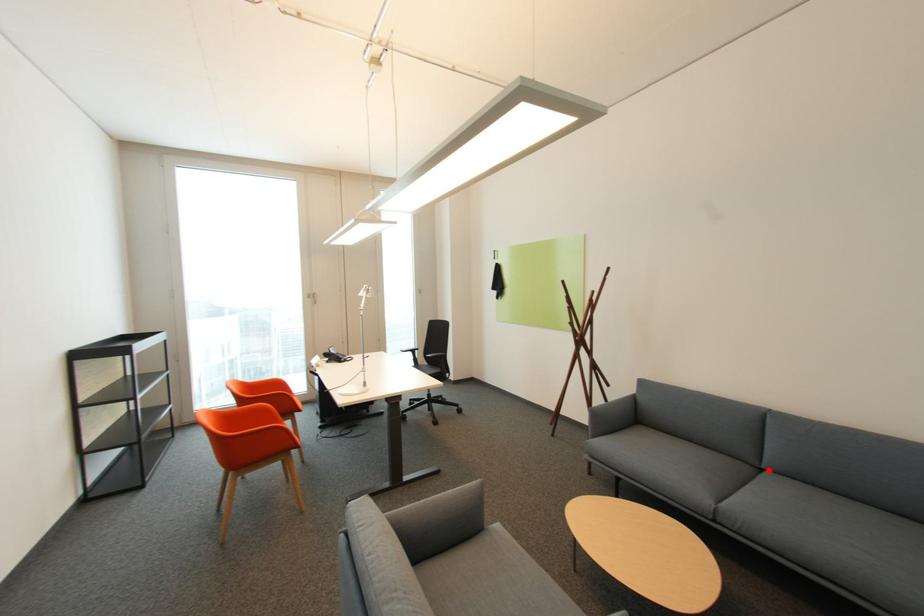
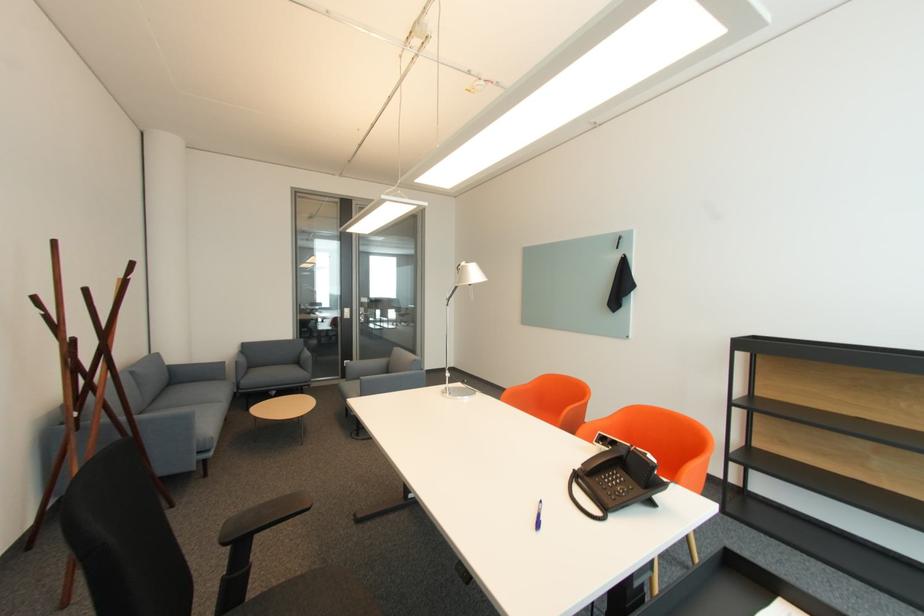
Where in the second image is the point corresponding to the highlighted location from the first image?

(151, 411)